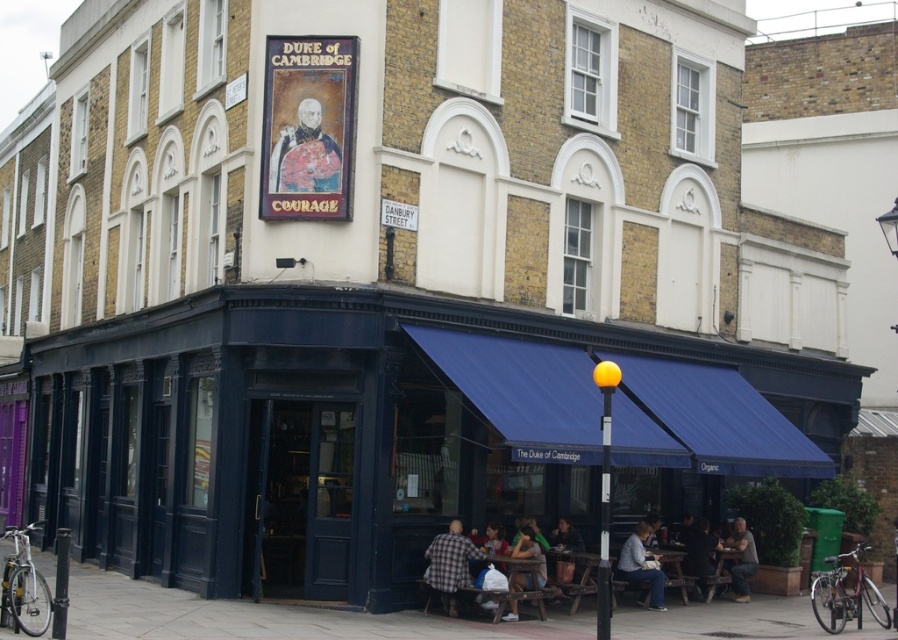
In the scene shown: You are a delivery person who needs to hang a new sign that is 1 meter wide. You have two options to place it either above the matte gold portrait at upper center or below the checkered fabric shirt at lower center. Based on their widths, which location would allow the new sign to fit without overlapping?

The matte gold portrait at upper center might be wider than the checkered fabric shirt at lower center, so placing the new sign above the matte gold portrait at upper center has a higher chance of fitting without overlapping since it potentially has more width available.

You are a tailor trying to decide which garment to work on next. You have the matte gray jacket at lower center and the dark blue shirt at lower right in front of you. Which garment has a smaller width?

The matte gray jacket at lower center has a smaller width than the dark blue shirt at lower right according to the description.